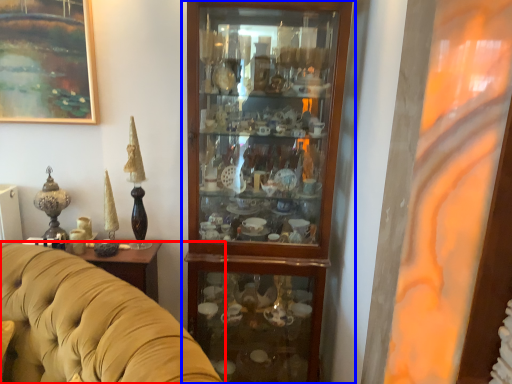
Question: Among these objects, which one is nearest to the camera, studio couch (highlighted by a red box) or cupboard (highlighted by a blue box)?

Choices:
 (A) studio couch
 (B) cupboard

Answer: (A)